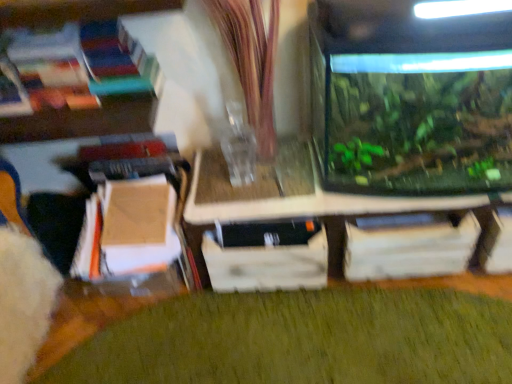
Where is `wooden drawer at center`? This screenshot has height=384, width=512. wooden drawer at center is located at coordinates (266, 266).

Find the location of a particular element. The height and width of the screenshot is (384, 512). transparent glass tank at right is located at coordinates (412, 100).

Where is `green matte plant at lower center`? green matte plant at lower center is located at coordinates (283, 336).

Between wooden drawer at center and transparent glass tank at center, which one appears on the left side from the viewer's perspective?

From the viewer's perspective, wooden drawer at center appears more on the left side.

I want to click on drawer located below the transparent glass tank at center (from the image's perspective), so tap(266, 266).

How far apart are wooden drawer at center and transparent glass tank at center?

wooden drawer at center and transparent glass tank at center are 4.62 inches apart.

From a real-world perspective, relative to transparent glass tank at center, is wooden drawer at center vertically above or below?

In terms of real-world spatial position, wooden drawer at center is below transparent glass tank at center.

Between green matte plant at lower center and wooden drawer at center, which one appears on the right side from the viewer's perspective?

Positioned to the right is green matte plant at lower center.

From a real-world perspective, is green matte plant at lower center physically below wooden drawer at center?

Answer: Correct, in the physical world, green matte plant at lower center is lower than wooden drawer at center.

Is green matte plant at lower center far from wooden drawer at center?

They are positioned close to each other.

Considering the points (354, 263) and (303, 334), which point is behind, point (354, 263) or point (303, 334)?

Positioned behind is point (354, 263).

This screenshot has height=384, width=512. In order to click on table behind the green matte plant at lower center in this screenshot , I will do `click(334, 229)`.

From a real-world perspective, does transparent glass tank at center sit lower than green matte plant at lower center?

No.

Does transparent glass tank at center have a lesser width compared to green matte plant at lower center?

Correct, the width of transparent glass tank at center is less than that of green matte plant at lower center.

Considering the positions of objects transparent glass tank at center and transparent glass tank at right in the image provided, who is in front, transparent glass tank at center or transparent glass tank at right?

transparent glass tank at right is closer to the camera.

From the image's perspective, which one is positioned lower, transparent glass tank at center or transparent glass tank at right?

transparent glass tank at center.

Image resolution: width=512 pixels, height=384 pixels. In order to click on table behind the transparent glass tank at right in this screenshot , I will do `click(334, 229)`.

Choose the correct answer: Is transparent glass tank at center inside transparent glass tank at right or outside it?

transparent glass tank at center is outside transparent glass tank at right.

In the scene shown: Which object is wider, wooden drawer at center or green matte plant at lower center?

green matte plant at lower center is wider.

Is green matte plant at lower center a part of wooden drawer at center?

That's incorrect, green matte plant at lower center is not inside wooden drawer at center.

Who is shorter, wooden drawer at center or green matte plant at lower center?

green matte plant at lower center.

In the scene shown: From a real-world perspective, is transparent glass tank at center positioned above or below wooden drawer at center?

In terms of real-world spatial position, transparent glass tank at center is above wooden drawer at center.

Considering the sizes of transparent glass tank at center and wooden drawer at center in the image, is transparent glass tank at center bigger or smaller than wooden drawer at center?

Considering their sizes, transparent glass tank at center takes up more space than wooden drawer at center.

Based on the photo, from the image's perspective, is transparent glass tank at center located beneath wooden drawer at center?

No.

Measure the distance between transparent glass tank at center and wooden drawer at center.

The distance of transparent glass tank at center from wooden drawer at center is 4.62 inches.

Considering the relative sizes of green matte plant at lower center and transparent glass tank at right in the image provided, is green matte plant at lower center shorter than transparent glass tank at right?

Yes.

Is green matte plant at lower center wider or thinner than transparent glass tank at right?

In the image, green matte plant at lower center appears to be wider than transparent glass tank at right.

Is point (55, 336) closer or farther from the camera than point (352, 182)?

Point (55, 336) is positioned farther from the camera compared to point (352, 182).

Image resolution: width=512 pixels, height=384 pixels. I want to click on drawer lying on the left of transparent glass tank at center, so click(x=266, y=266).

At what (x,y) coordinates should I click in order to perform the action: click on plant below the wooden drawer at center (from the image's perspective). Please return your answer as a coordinate pair (x, y). The image size is (512, 384). Looking at the image, I should click on (283, 336).

Considering their positions, is transparent glass tank at center positioned further to wooden drawer at center than green matte plant at lower center?

green matte plant at lower center is positioned further to the anchor wooden drawer at center.

Looking at this image, looking at the image, which one is located closer to wooden drawer at center, transparent glass tank at center or transparent glass tank at right?

transparent glass tank at center is positioned closer to the anchor wooden drawer at center.

Based on their spatial positions, is wooden drawer at center or green matte plant at lower center further from transparent glass tank at right?

green matte plant at lower center.

When comparing their distances from wooden drawer at center, does green matte plant at lower center or transparent glass tank at center seem closer?

transparent glass tank at center is positioned closer to the anchor wooden drawer at center.

Looking at this image, looking at the image, which one is located closer to wooden drawer at center, transparent glass tank at right or green matte plant at lower center?

green matte plant at lower center lies closer to wooden drawer at center than the other object.

When comparing their distances from transparent glass tank at center, does wooden drawer at center or green matte plant at lower center seem closer?

wooden drawer at center is positioned closer to the anchor transparent glass tank at center.

From the image, which object appears to be nearer to green matte plant at lower center, transparent glass tank at right or transparent glass tank at center?

transparent glass tank at center is positioned closer to the anchor green matte plant at lower center.

Considering their positions, is wooden drawer at center positioned further to transparent glass tank at center than transparent glass tank at right?

transparent glass tank at right.

At what (x,y) coordinates should I click in order to perform the action: click on table between transparent glass tank at right and green matte plant at lower center in the vertical direction. Please return your answer as a coordinate pair (x, y). The image size is (512, 384). Looking at the image, I should click on point(334,229).

Where is `plant between wooden drawer at center and transparent glass tank at center in the horizontal direction`? The width and height of the screenshot is (512, 384). plant between wooden drawer at center and transparent glass tank at center in the horizontal direction is located at coordinates (283, 336).

Identify the location of drawer between transparent glass tank at right and green matte plant at lower center from top to bottom. (266, 266).

Image resolution: width=512 pixels, height=384 pixels. Identify the location of table between transparent glass tank at right and wooden drawer at center vertically. (334, 229).